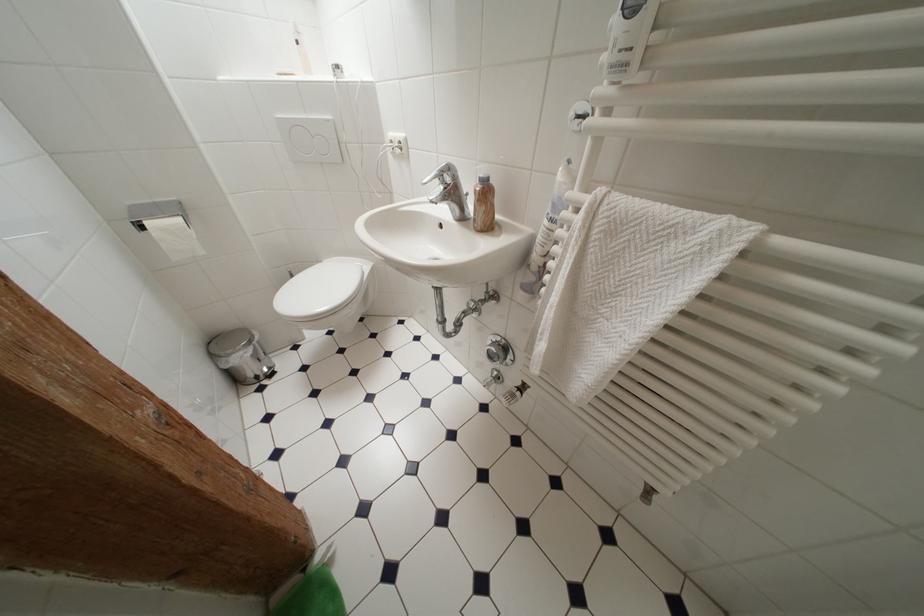
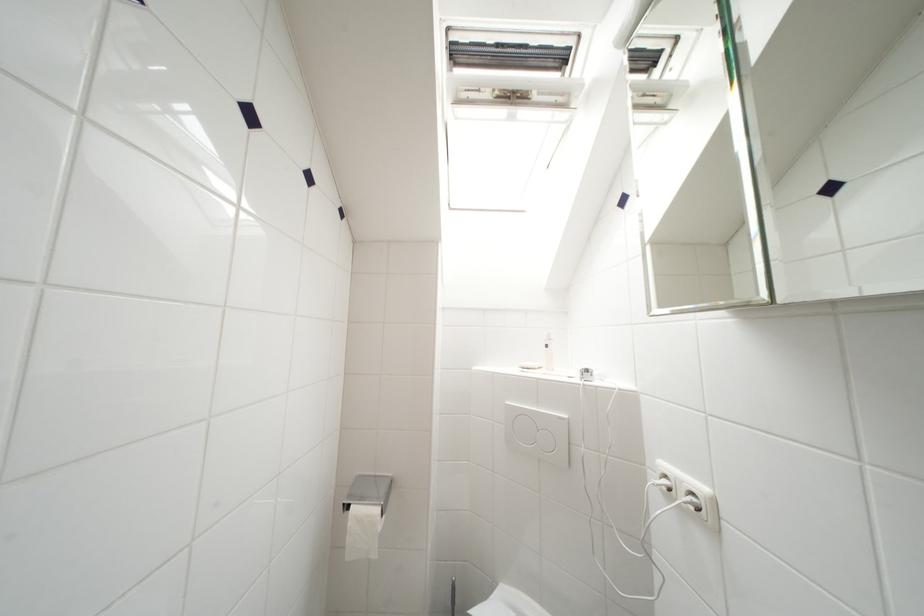
Locate, in the second image, the point that corresponds to pixel 407 146 in the first image.

(699, 498)